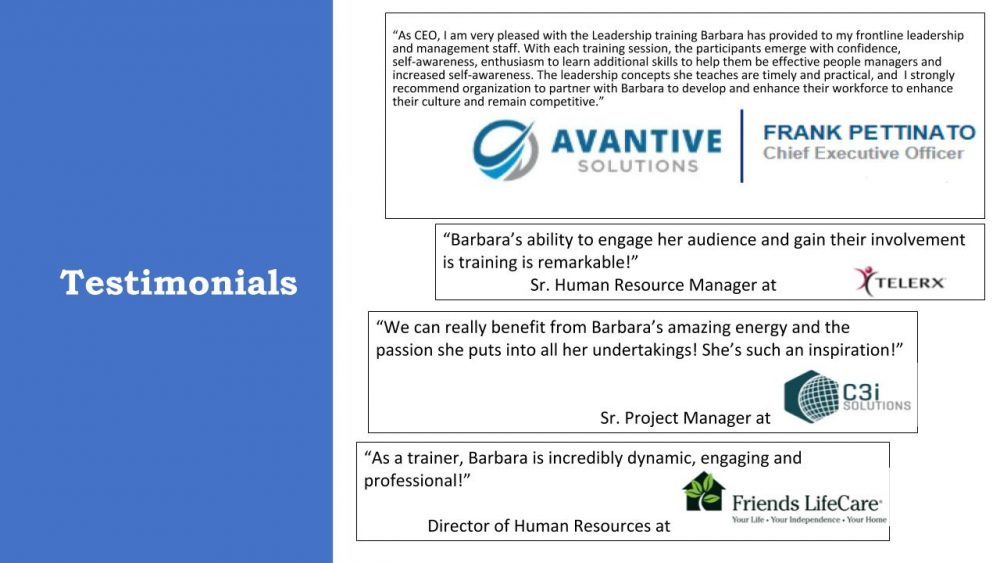
Where is `globe`? This screenshot has height=563, width=1000. globe is located at coordinates (822, 406).